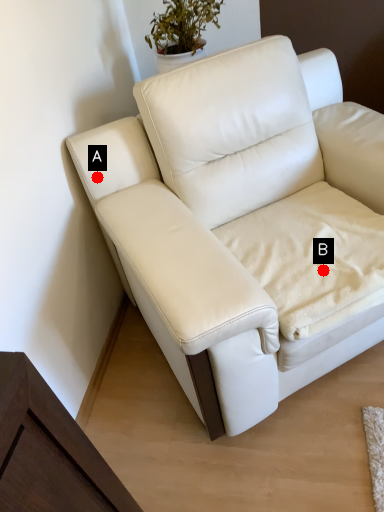
Question: Two points are circled on the image, labeled by A and B beside each circle. Which point appears closest to the camera in this image?

Choices:
 (A) A is closer
 (B) B is closer

Answer: (B)